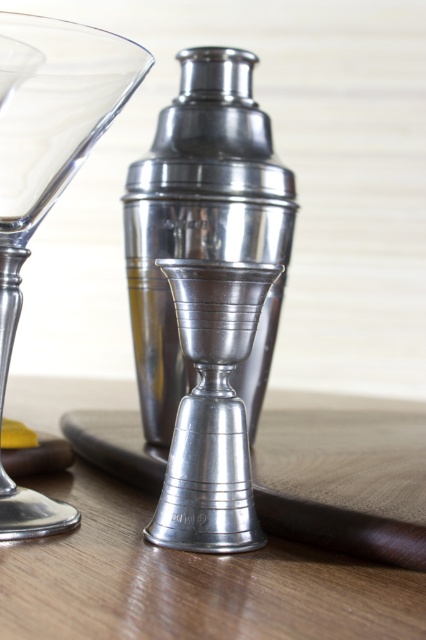
Describe the element at coordinates (187, 580) in the screenshot. The height and width of the screenshot is (640, 426). I see `metallic silver cup at lower center` at that location.

What do you see at coordinates (187, 580) in the screenshot? The image size is (426, 640). I see `metallic silver cup at lower center` at bounding box center [187, 580].

At what (x,y) coordinates should I click in order to perform the action: click on metallic silver cup at lower center. Please return your answer as a coordinate pair (x, y). Looking at the image, I should click on (187, 580).